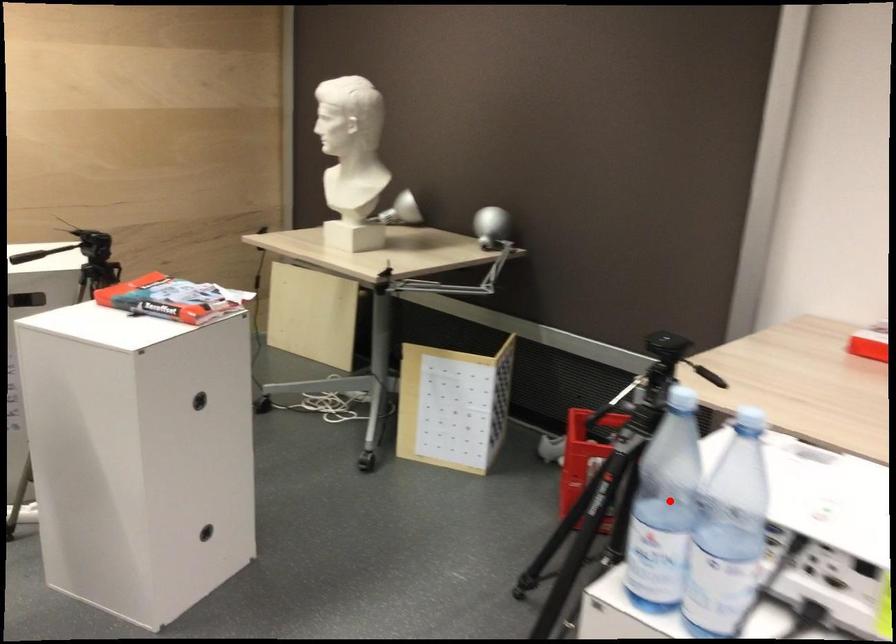
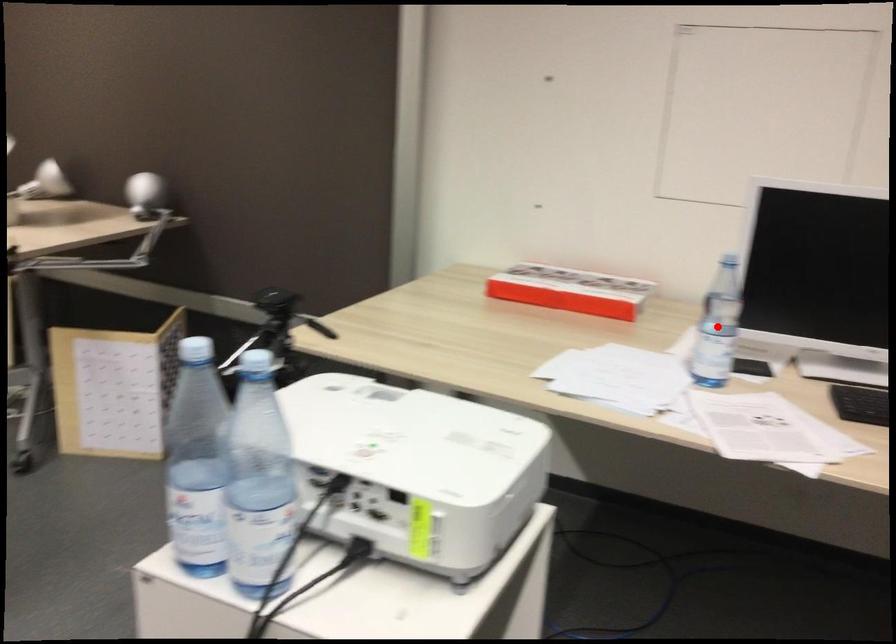
I am providing you with two images of the same scene from different viewpoints. A red point is marked on the first image and another point is marked on the second image. Are the points marked in image1 and image2 representing the same 3D position?

No